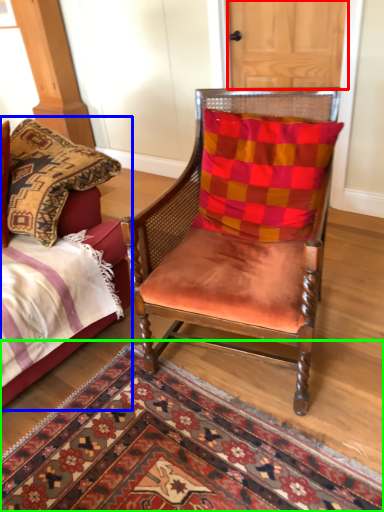
Question: Estimate the real-world distances between objects in this image. Which object is farther from door (highlighted by a red box), bed (highlighted by a blue box) or mat (highlighted by a green box)?

Choices:
 (A) bed
 (B) mat

Answer: (B)